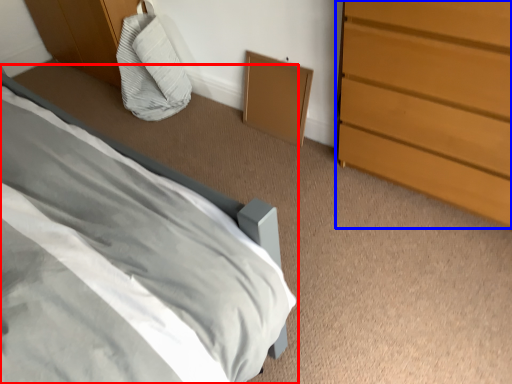
Question: Which object is closer to the camera taking this photo, bed (highlighted by a red box) or chest of drawers (highlighted by a blue box)?

Choices:
 (A) bed
 (B) chest of drawers

Answer: (A)